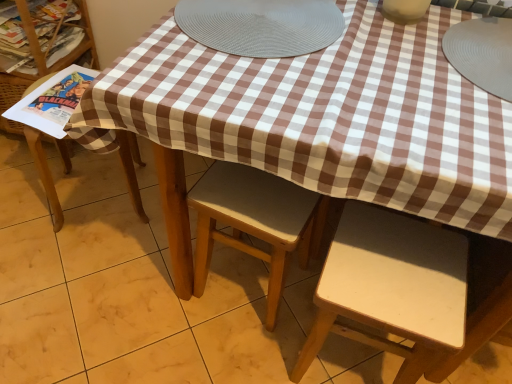
Find the location of `free space above matte paper magazine at left (from a real-world perspective)`. free space above matte paper magazine at left (from a real-world perspective) is located at coordinates (59, 94).